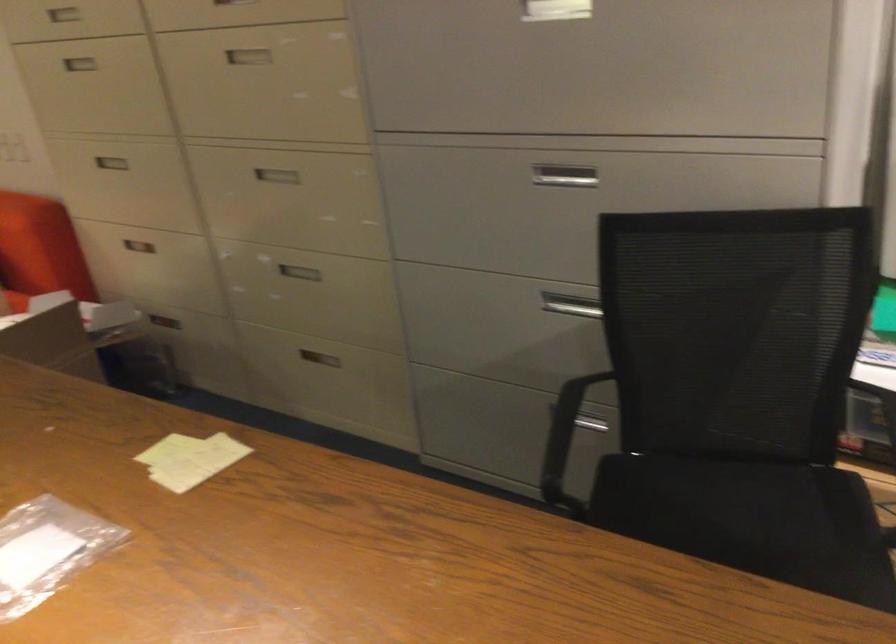
What do you see at coordinates (739, 496) in the screenshot? I see `a chair sitting surface` at bounding box center [739, 496].